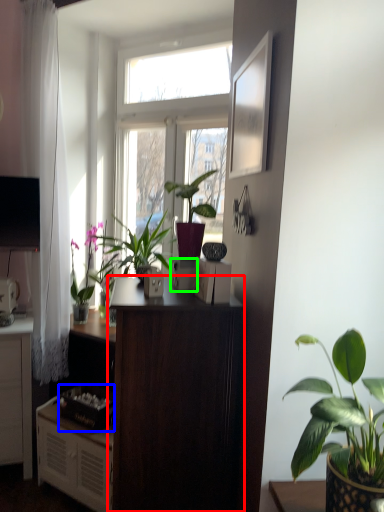
Question: Estimate the real-world distances between objects in this image. Which object is farther from desk (highlighted by a red box), appliance (highlighted by a blue box) or appliance (highlighted by a green box)?

Choices:
 (A) appliance
 (B) appliance

Answer: (A)